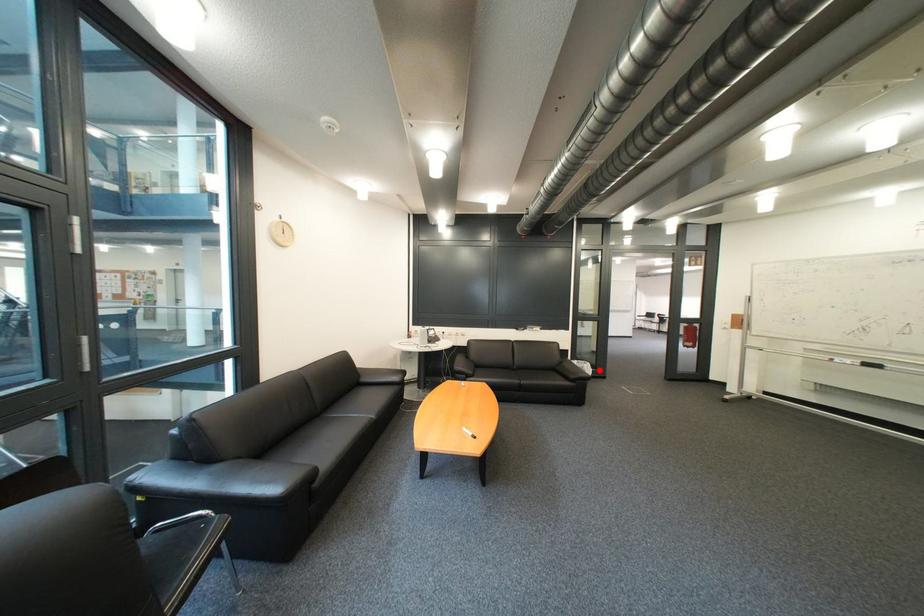
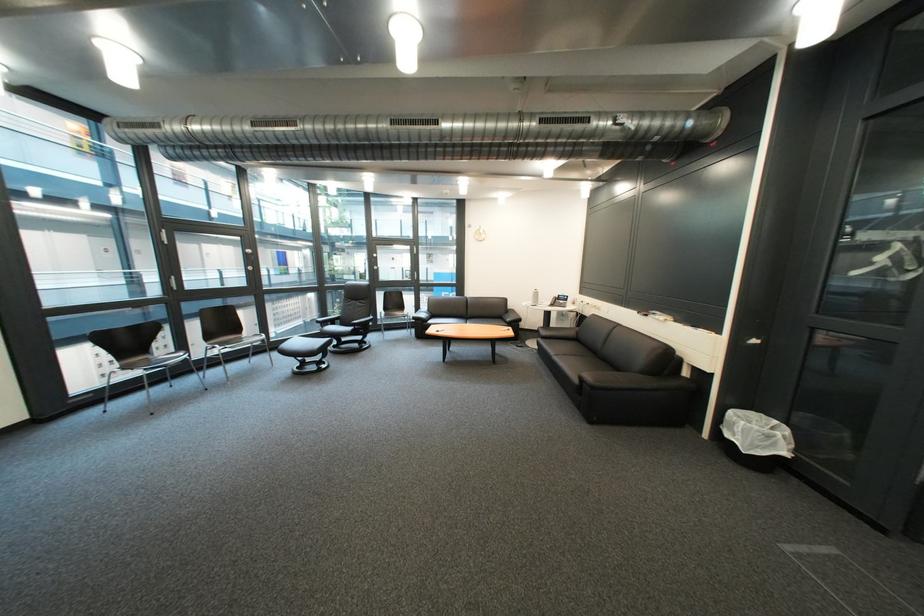
Question: A red point is marked in image1. In image2, is the corresponding 3D point closer to the camera or farther? Reply with the corresponding letter.

Choices:
 (A) The corresponding 3D point is closer.
 (B) The corresponding 3D point is farther.

Answer: (A)